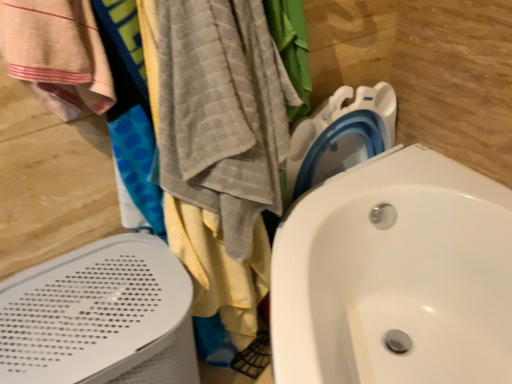
Question: Based on their sizes in the image, would you say white perforated bath heater at left is bigger or smaller than white glossy sink at center?

Choices:
 (A) small
 (B) big

Answer: (A)

Question: Relative to white glossy sink at center, is white perforated bath heater at left in front or behind?

Choices:
 (A) front
 (B) behind

Answer: (B)

Question: Which object is the farthest from the gray textured towel at left, which is the first beach towel in right-to-left order?

Choices:
 (A) white perforated bath heater at left
 (B) white glossy sink at center
 (C) beige woven towel at left, which is the 2th beach towel from right to left

Answer: (B)

Question: Estimate the real-world distances between objects in this image. Which object is farther from the white glossy sink at center?

Choices:
 (A) white perforated bath heater at left
 (B) beige woven towel at left, positioned as the first beach towel in left-to-right order
 (C) gray textured towel at left, acting as the 2th beach towel starting from the left

Answer: (B)